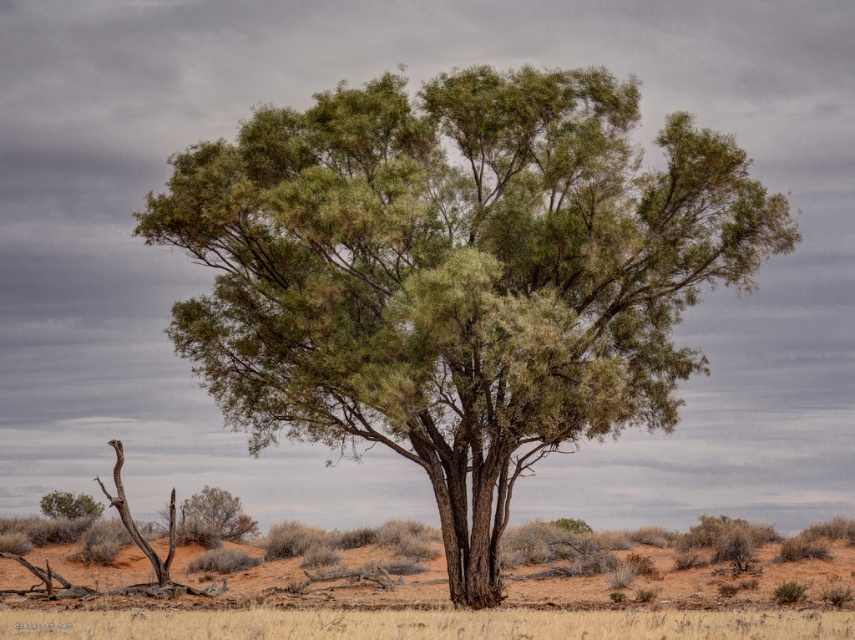
Who is higher up, green textured tree at center or green leafy shrub at lower left?

green textured tree at center

Is point (231, 209) farther from viewer compared to point (187, 524)?

No, (231, 209) is in front of (187, 524).

I want to click on green textured tree at center, so click(457, 275).

Does green textured tree at center have a lesser width compared to green leafy bush at lower left?

In fact, green textured tree at center might be wider than green leafy bush at lower left.

Does green textured tree at center have a greater height compared to green leafy bush at lower left?

Correct, green textured tree at center is much taller as green leafy bush at lower left.

Who is more distant from viewer, (485, 524) or (75, 531)?

The point (75, 531) is more distant.

This screenshot has height=640, width=855. In order to click on green textured tree at center in this screenshot , I will do `click(457, 275)`.

Can you confirm if dry grass at center is wider than green leafy shrub at lower left?

Correct, the width of dry grass at center exceeds that of green leafy shrub at lower left.

Does dry grass at center appear on the right side of green leafy shrub at lower left?

Yes, dry grass at center is to the right of green leafy shrub at lower left.

Who is more forward, (323,625) or (240,529)?

Point (323,625)

Identify the location of dry grass at center. This screenshot has width=855, height=640. (423, 624).